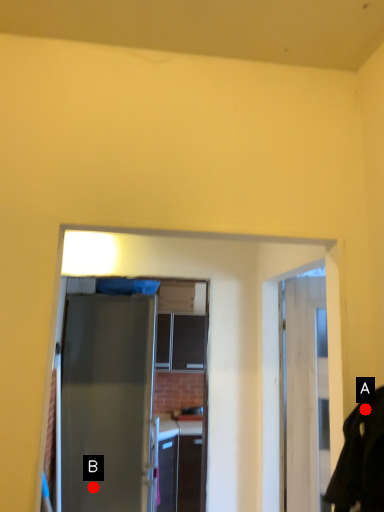
Question: Two points are circled on the image, labeled by A and B beside each circle. Which point is closer to the camera taking this photo?

Choices:
 (A) A is closer
 (B) B is closer

Answer: (A)